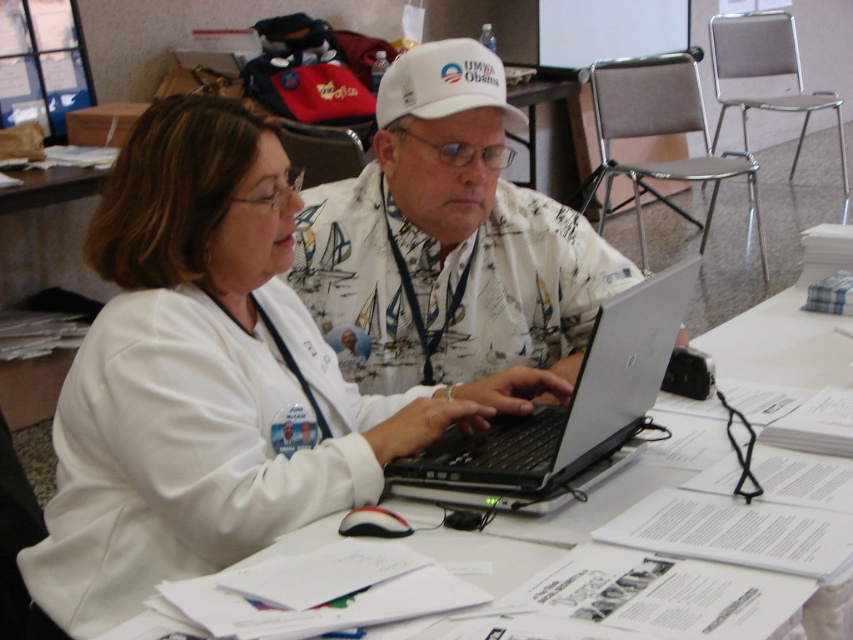
You are a photographer taking a picture of the two people at the table. You want to ensure that the white fabric coat at center and the white fabric shirt at center are both visible in the photo. Since they are both white, which one is more likely to be obscured by the other?

The white fabric coat at center is below the white fabric shirt at center, so the coat might be partially hidden by the shirt in the photo.

You are standing in front of the table where the two people are working. You need to place a small object exactly at the point closer to you between point (437, 152) and point (413, 93). Which point should you choose?

Point (437, 152) is further to the viewer than point (413, 93), so the point closer to you is point (413, 93). You should choose point (413, 93).

You are a tailor measuring the distance between two garments. The white fabric coat at center and the white fabric shirt at center need to be placed on a rack. Can you fit both on a rack that can only hold items spaced 12 inches apart?

The distance between the white fabric coat at center and white fabric shirt at center is 13.71 inches, which is greater than the 12 inches the rack can accommodate. Therefore, they cannot be placed on the rack together.